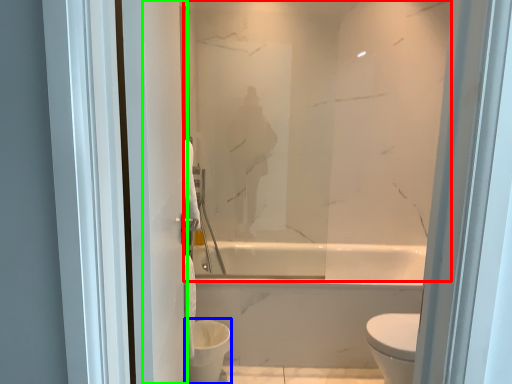
Question: Which is farther away from mirror (highlighted by a red box)? toilet bowl (highlighted by a blue box) or screen door (highlighted by a green box)?

Choices:
 (A) toilet bowl
 (B) screen door

Answer: (A)